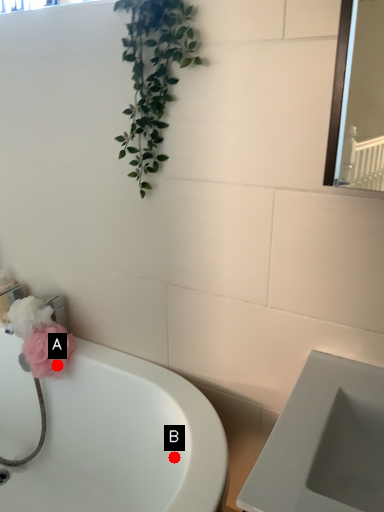
Question: Two points are circled on the image, labeled by A and B beside each circle. Which point appears closest to the camera in this image?

Choices:
 (A) A is closer
 (B) B is closer

Answer: (B)